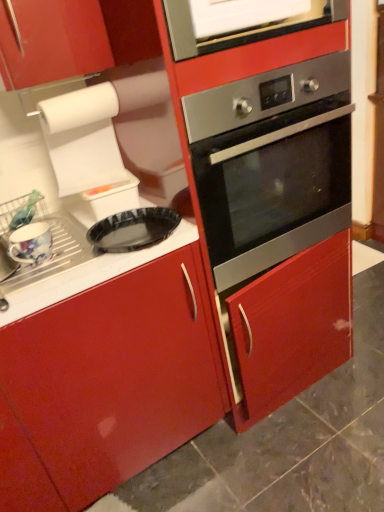
Question: Is there a large distance between white glossy vent at upper center and black glossy pizza pan at center?

Choices:
 (A) yes
 (B) no

Answer: (B)

Question: Could you tell me if white glossy vent at upper center is turned towards black glossy pizza pan at center?

Choices:
 (A) yes
 (B) no

Answer: (B)

Question: Is white glossy vent at upper center positioned with its back to black glossy pizza pan at center?

Choices:
 (A) yes
 (B) no

Answer: (B)

Question: Does white glossy vent at upper center have a smaller size compared to black glossy pizza pan at center?

Choices:
 (A) no
 (B) yes

Answer: (A)

Question: Does white glossy vent at upper center appear on the left side of black glossy pizza pan at center?

Choices:
 (A) no
 (B) yes

Answer: (A)

Question: From the image's perspective, would you say white glossy vent at upper center is positioned over black glossy pizza pan at center?

Choices:
 (A) yes
 (B) no

Answer: (A)

Question: Is floral ceramic mug at left at the right side of stainless steel oven at center?

Choices:
 (A) no
 (B) yes

Answer: (A)

Question: Considering the relative positions of floral ceramic mug at left and stainless steel oven at center in the image provided, is floral ceramic mug at left to the left of stainless steel oven at center from the viewer's perspective?

Choices:
 (A) no
 (B) yes

Answer: (B)

Question: Is floral ceramic mug at left turned away from stainless steel oven at center?

Choices:
 (A) yes
 (B) no

Answer: (B)

Question: Is floral ceramic mug at left surrounding stainless steel oven at center?

Choices:
 (A) no
 (B) yes

Answer: (A)

Question: Considering the relative sizes of floral ceramic mug at left and stainless steel oven at center in the image provided, is floral ceramic mug at left smaller than stainless steel oven at center?

Choices:
 (A) no
 (B) yes

Answer: (B)

Question: Is floral ceramic mug at left aimed at stainless steel oven at center?

Choices:
 (A) no
 (B) yes

Answer: (A)

Question: Considering the relative sizes of white glossy vent at upper center and stainless steel oven at center in the image provided, is white glossy vent at upper center bigger than stainless steel oven at center?

Choices:
 (A) yes
 (B) no

Answer: (B)